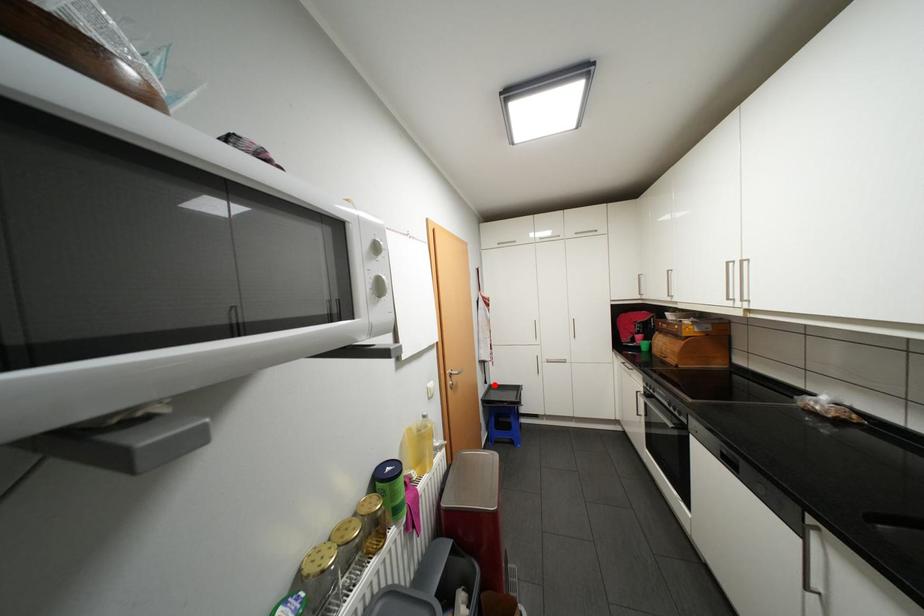
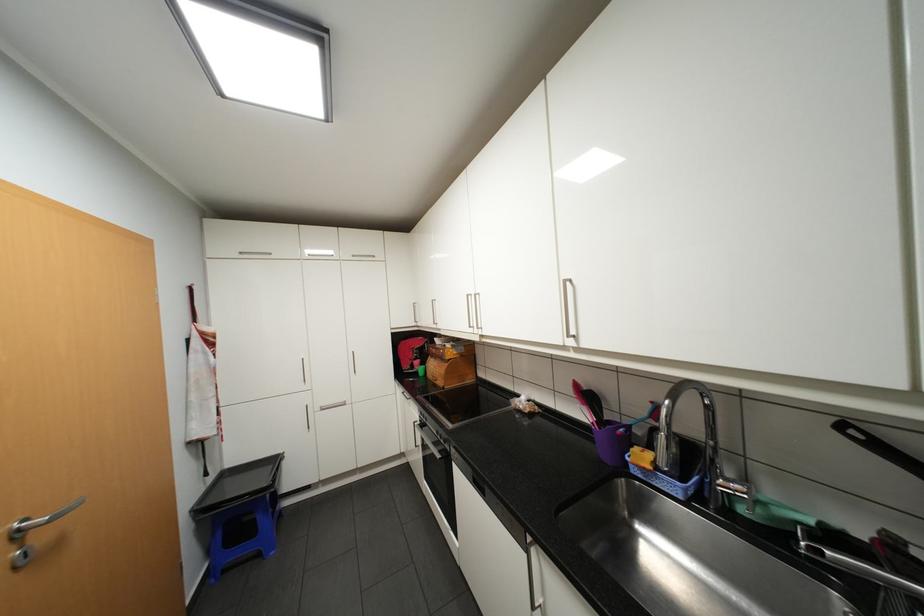
Locate, in the second image, the point that corresponds to the highlighted location in the first image.

(220, 476)